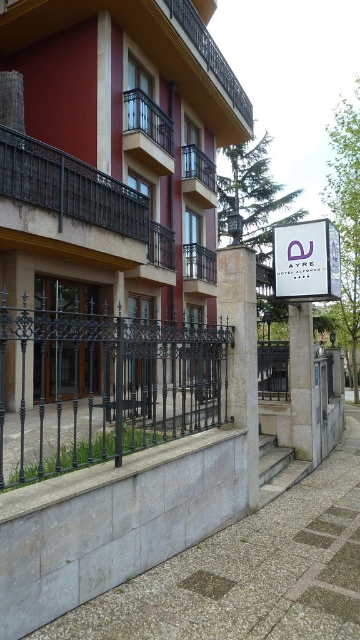
Question: Among these points, which one is nearest to the camera?

Choices:
 (A) (180, 355)
 (B) (108, 44)
 (C) (236, 368)

Answer: (A)

Question: From the image, what is the correct spatial relationship of matte brown building at center in relation to purple glossy sign at center?

Choices:
 (A) above
 (B) below

Answer: (A)

Question: Which point is farther to the camera?

Choices:
 (A) white stone pillar at center
 (B) purple glossy sign at center
 (C) black wrought iron fence at center

Answer: (B)

Question: Is purple glossy sign at center behind white concrete pillar at center?

Choices:
 (A) no
 (B) yes

Answer: (A)

Question: Can you confirm if matte brown building at center is wider than black wrought iron fence at center?

Choices:
 (A) no
 (B) yes

Answer: (B)

Question: Which point appears farthest from the camera in this image?

Choices:
 (A) (82, 444)
 (B) (289, 328)
 (C) (254, 440)
 (D) (204, 260)

Answer: (B)